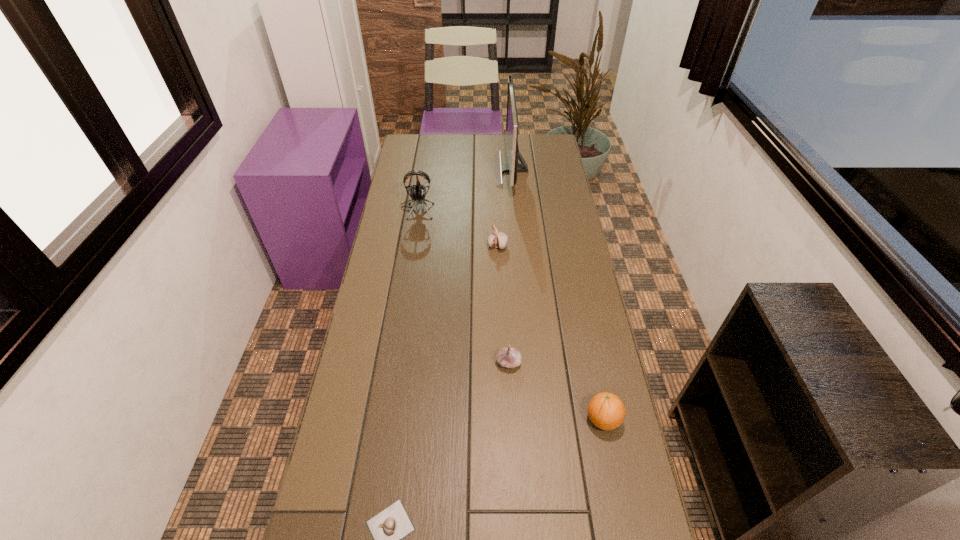
Select which garlic appears as the second closest to the farthest garlic. Please provide its 2D coordinates. Your answer should be formatted as a tuple, i.e. [(x, y)], where the tuple contains the x and y coordinates of a point satisfying the conditions above.

[(388, 528)]

Locate an element on the screen. This screenshot has width=960, height=540. garlic that is the second closest to the fourth nearest object is located at coordinates (388, 528).

In order to click on vacant region that satisfies the following two spatial constraints: 1. on the screen side of the monitor; 2. on the left side of the orange in this screenshot , I will do `click(535, 420)`.